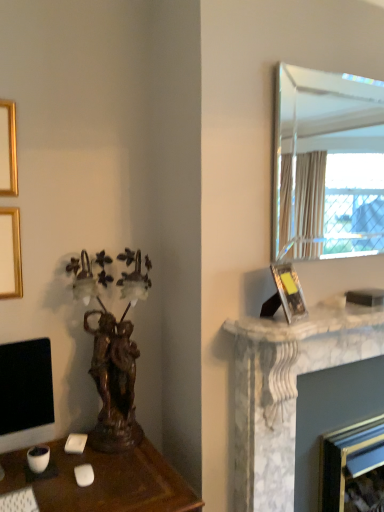
Measure the distance between point (255, 392) and camera.

Point (255, 392) and camera are 5.24 feet apart.

I want to click on white marble fireplace at right, so click(308, 321).

Describe the element at coordinates (308, 321) in the screenshot. I see `white marble fireplace at right` at that location.

Identify the location of matte black picture frame at right. (289, 292).

What is the approximate height of clear glass mirror at upper right?

31.42 inches.

The height and width of the screenshot is (512, 384). What are the coordinates of `white plastic keyboard at lower left` in the screenshot? It's located at (19, 501).

This screenshot has height=512, width=384. I want to click on white marble fireplace at right, the 2th fireplace in the bottom-to-top sequence, so (287, 389).

How different are the orientations of matte black monitor at lower left and matte black picture frame at right in degrees?

The facing directions of matte black monitor at lower left and matte black picture frame at right are 21.4 degrees apart.

Measure the distance between matte black monitor at lower left and matte black picture frame at right.

The distance of matte black monitor at lower left from matte black picture frame at right is 95.47 centimeters.

From the image's perspective, which one is positioned lower, matte black monitor at lower left or matte black picture frame at right?

matte black monitor at lower left, from the image's perspective.

Is matte black monitor at lower left spatially inside matte black picture frame at right, or outside of it?

matte black monitor at lower left is not inside matte black picture frame at right, it's outside.

From the image's perspective, which one is positioned higher, matte black monitor at lower left or white marble fireplace at right, the 2th fireplace in the bottom-to-top sequence?

matte black monitor at lower left appears higher in the image.

Is white marble fireplace at right, the 2th fireplace in the bottom-to-top sequence, completely or partially inside matte black monitor at lower left?

Definitely not — white marble fireplace at right, the 2th fireplace in the bottom-to-top sequence, is not inside matte black monitor at lower left.

Which is further, (6, 411) or (295, 381)?

The point (295, 381) is more distant.

From the picture: Does matte black monitor at lower left come in front of white marble fireplace at right, the 2th fireplace in the bottom-to-top sequence?

Yes, matte black monitor at lower left is closer to the camera.

Which object is positioned more to the left, white marble fireplace at right, the 1th fireplace ordered from the bottom, or matte black monitor at lower left?

matte black monitor at lower left.

From the image's perspective, starting from the matte black monitor at lower left, which fireplace is the 2nd one below? Please provide its 2D coordinates.

[(353, 468)]

From the image's perspective, between white marble fireplace at right, marked as the 2th fireplace in a top-to-bottom arrangement, and matte black monitor at lower left, which one is located above?

matte black monitor at lower left.

Considering the sizes of white marble fireplace at right, marked as the 2th fireplace in a top-to-bottom arrangement, and matte black monitor at lower left in the image, is white marble fireplace at right, marked as the 2th fireplace in a top-to-bottom arrangement, wider or thinner than matte black monitor at lower left?

In the image, white marble fireplace at right, marked as the 2th fireplace in a top-to-bottom arrangement, appears to be wider than matte black monitor at lower left.

In the scene shown: In terms of height, does clear glass mirror at upper right look taller or shorter compared to white marble fireplace at right, the 2th fireplace in the bottom-to-top sequence?

Clearly, clear glass mirror at upper right is shorter compared to white marble fireplace at right, the 2th fireplace in the bottom-to-top sequence.

Which point is more forward, (374, 211) or (313, 365)?

The point (313, 365) is more forward.

Is clear glass mirror at upper right directly adjacent to white marble fireplace at right, the 2th fireplace in the bottom-to-top sequence?

No, clear glass mirror at upper right is not making contact with white marble fireplace at right, the 2th fireplace in the bottom-to-top sequence.

Between clear glass mirror at upper right and white marble fireplace at right, the first fireplace when ordered from top to bottom, which one has larger width?

Wider between the two is white marble fireplace at right, the first fireplace when ordered from top to bottom.

From a real-world perspective, which is physically below, clear glass mirror at upper right or white marble fireplace at right?

white marble fireplace at right, from a real-world perspective.

Is clear glass mirror at upper right bigger or smaller than white marble fireplace at right?

Considering their sizes, clear glass mirror at upper right takes up more space than white marble fireplace at right.

Does clear glass mirror at upper right have a greater width compared to white marble fireplace at right?

Incorrect, the width of clear glass mirror at upper right does not surpass that of white marble fireplace at right.

From their relative heights in the image, would you say clear glass mirror at upper right is taller or shorter than matte black picture frame at right?

clear glass mirror at upper right is taller than matte black picture frame at right.

You are a GUI agent. You are given a task and a screenshot of the screen. Output one action in this format:
    pyautogui.click(x=<x>, y=<y>)
    Task: Click on the mirror on the right of matte black picture frame at right
    Image resolution: width=384 pixels, height=512 pixels.
    Given the screenshot: What is the action you would take?
    pyautogui.click(x=327, y=165)

How many degrees apart are the facing directions of clear glass mirror at upper right and matte black picture frame at right?

The facing directions of clear glass mirror at upper right and matte black picture frame at right are 22.8 degrees apart.

From the picture: In terms of width, does clear glass mirror at upper right look wider or thinner when compared to matte black picture frame at right?

clear glass mirror at upper right is thinner than matte black picture frame at right.

From a real-world perspective, does white marble fireplace at right, the 2th fireplace in the bottom-to-top sequence, sit lower than clear glass mirror at upper right?

Yes.

Does white marble fireplace at right, the first fireplace when ordered from top to bottom, turn towards clear glass mirror at upper right?

No.

Considering the relative sizes of white marble fireplace at right, the first fireplace when ordered from top to bottom, and clear glass mirror at upper right in the image provided, is white marble fireplace at right, the first fireplace when ordered from top to bottom, shorter than clear glass mirror at upper right?

Incorrect, the height of white marble fireplace at right, the first fireplace when ordered from top to bottom, does not fall short of that of clear glass mirror at upper right.

Can you confirm if white marble fireplace at right, the 2th fireplace in the bottom-to-top sequence, is bigger than clear glass mirror at upper right?

Indeed, white marble fireplace at right, the 2th fireplace in the bottom-to-top sequence, has a larger size compared to clear glass mirror at upper right.

Find the location of a particular element. Image resolution: width=384 pixels, height=512 pixels. picture frame positioned vertically above the matte black monitor at lower left (from a real-world perspective) is located at coordinates (289, 292).

At what (x,y) coordinates should I click in order to perform the action: click on computer monitor on the left of white marble fireplace at right, the first fireplace when ordered from top to bottom. Please return your answer as a coordinate pair (x, y). This screenshot has width=384, height=512. Looking at the image, I should click on (25, 386).

When comparing their distances from white marble fireplace at right, the 2th fireplace in the bottom-to-top sequence, does clear glass mirror at upper right or white marble fireplace at right, the 1th fireplace ordered from the bottom, seem closer?

white marble fireplace at right, the 1th fireplace ordered from the bottom, is closer to white marble fireplace at right, the 2th fireplace in the bottom-to-top sequence.

Which object lies further to the anchor point matte black picture frame at right, white plastic keyboard at lower left or white marble fireplace at right, the first fireplace when ordered from top to bottom?

Based on the image, white plastic keyboard at lower left appears to be further to matte black picture frame at right.

Which object lies further to the anchor point white marble fireplace at right, the 2th fireplace in the bottom-to-top sequence, white marble fireplace at right, the 1th fireplace ordered from the bottom, or clear glass mirror at upper right?

Among the two, clear glass mirror at upper right is located further to white marble fireplace at right, the 2th fireplace in the bottom-to-top sequence.

Looking at this image, when comparing their distances from matte black picture frame at right, does white marble fireplace at right, the 1th fireplace ordered from the bottom, or white plastic keyboard at lower left seem further?

white plastic keyboard at lower left is positioned further to the anchor matte black picture frame at right.

Looking at the image, which one is located further to white marble fireplace at right, clear glass mirror at upper right or white plastic keyboard at lower left?

Based on the image, clear glass mirror at upper right appears to be further to white marble fireplace at right.

From the image, which object appears to be nearer to white marble fireplace at right, the 1th fireplace ordered from the bottom, white marble fireplace at right, the 2th fireplace in the bottom-to-top sequence, or matte black picture frame at right?

Among the two, white marble fireplace at right, the 2th fireplace in the bottom-to-top sequence, is located nearer to white marble fireplace at right, the 1th fireplace ordered from the bottom.

Which object lies nearer to the anchor point matte black monitor at lower left, matte black picture frame at right or white marble fireplace at right, marked as the 2th fireplace in a top-to-bottom arrangement?

Among the two, matte black picture frame at right is located nearer to matte black monitor at lower left.

Looking at the image, which one is located closer to white marble fireplace at right, white marble fireplace at right, the 2th fireplace in the bottom-to-top sequence, or clear glass mirror at upper right?

Among the two, white marble fireplace at right, the 2th fireplace in the bottom-to-top sequence, is located nearer to white marble fireplace at right.

Where is `picture frame between clear glass mirror at upper right and white marble fireplace at right from top to bottom`? This screenshot has width=384, height=512. picture frame between clear glass mirror at upper right and white marble fireplace at right from top to bottom is located at coordinates (289, 292).

Identify the location of computer monitor between white plastic keyboard at lower left and matte black picture frame at right from left to right. Image resolution: width=384 pixels, height=512 pixels. (25, 386).

Find the location of a particular element. counter top between clear glass mirror at upper right and white marble fireplace at right, the 2th fireplace in the bottom-to-top sequence, in the up-down direction is located at coordinates (308, 321).

At what (x,y) coordinates should I click in order to perform the action: click on computer monitor between white plastic keyboard at lower left and white marble fireplace at right, the 1th fireplace ordered from the bottom. Please return your answer as a coordinate pair (x, y). This screenshot has width=384, height=512. Looking at the image, I should click on (25, 386).